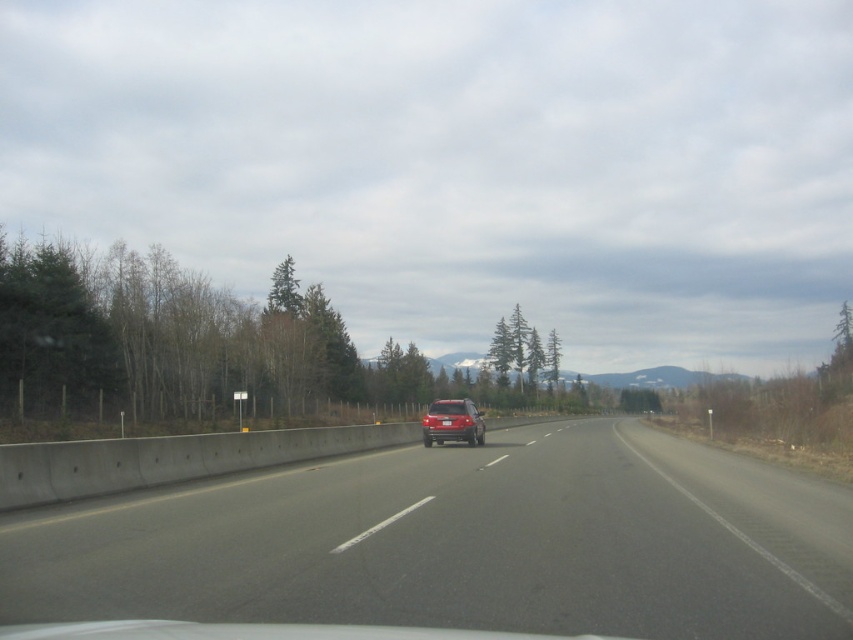
You are driving a car and need to overtake the satin red suv at center. Based on the smooth asphalt road at center, can you safely perform a lane change to pass the vehicle?

The smooth asphalt road at center might be wider than satin red suv at center, so there is a possibility that the road provides enough space to safely change lanes and overtake the vehicle. However, you should always check for other traffic before making any maneuvers.

You are driving a car that is 5.9 feet wide. You want to safely pass through the smooth asphalt road at center. Based on the scene description, can your car fit within the width of the road?

The smooth asphalt road at center is 18.09 feet wide. Since your car is 5.9 feet wide, it will easily fit within the road width.